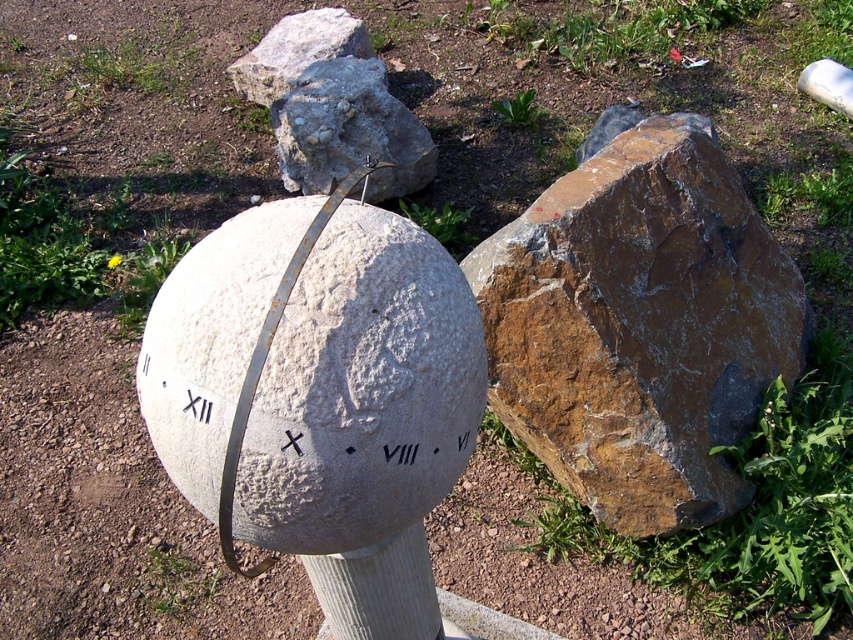
You are a gardener holding a 1.2 meter long garden hose. You need to water both the rusty metallic boulder at right and the gray rough stone boulder at center. Can you water both without moving the hose? Please explain your reasoning.

The distance between the rusty metallic boulder at right and the gray rough stone boulder at center is 1.11 meters. Since the garden hose is 1.2 meters long, it is slightly longer than the distance between them. Therefore, you can water both boulders without moving the hose as the hose length exceeds the separation distance.

You are standing at the point marked by the coordinate point at [357,88]. The spherical sundial is located at the center of the image. If you want to walk directly towards the sundial, which direction should you move relative to your current position?

You should move to the left because the spherical sundial is located to the left of the point marked by the coordinate point at [357,88].